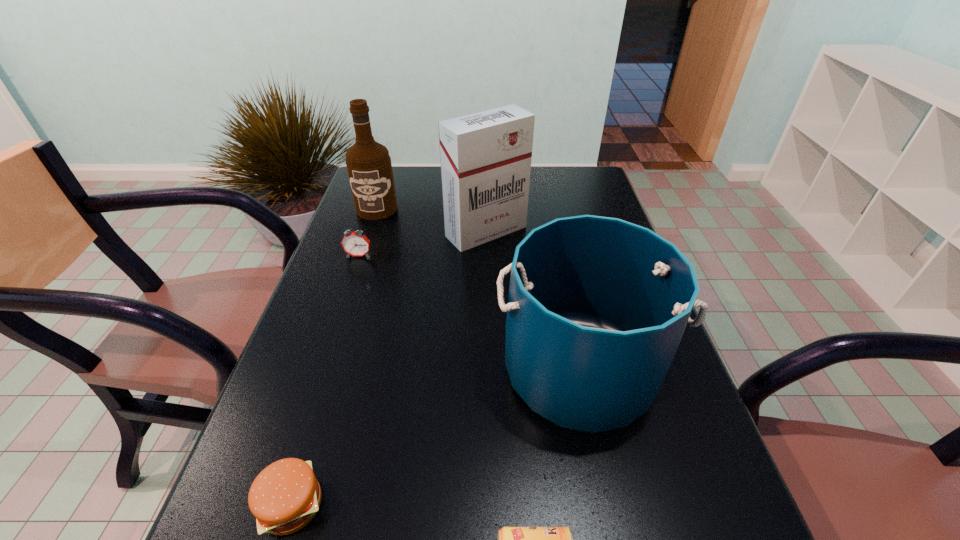
Where is `alcohol at the left edge`? alcohol at the left edge is located at coordinates (369, 167).

Locate an element on the screen. alarm clock located at the left edge is located at coordinates (354, 243).

Find the location of a particular element. object at the right edge is located at coordinates (597, 306).

The height and width of the screenshot is (540, 960). In order to click on object situated at the far left corner in this screenshot , I will do `click(369, 167)`.

In the image, there is a desktop. At what (x,y) coordinates should I click in order to perform the action: click on vacant space at the left edge. Please return your answer as a coordinate pair (x, y). Image resolution: width=960 pixels, height=540 pixels. Looking at the image, I should click on (354, 328).

Identify the location of vacant space at the far right corner of the desktop. Image resolution: width=960 pixels, height=540 pixels. (589, 182).

At what (x,y) coordinates should I click in order to perform the action: click on vacant point located between the alcohol and the third shortest object. Please return your answer as a coordinate pair (x, y). The image size is (960, 540). Looking at the image, I should click on (368, 232).

Find the location of a particular element. The width and height of the screenshot is (960, 540). vacant space in between the cigarette case and the fourth tallest object is located at coordinates (422, 244).

Identify the location of vacant area that lies between the cigarette case and the third shortest object. (422, 244).

Image resolution: width=960 pixels, height=540 pixels. Identify the location of unoccupied position between the third shortest object and the cigarette case. (422, 244).